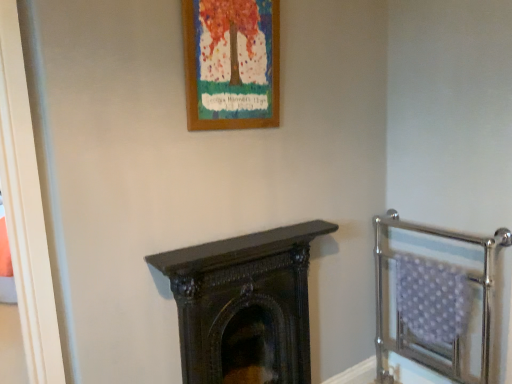
Question: Considering the positions of wooden frame at upper center and dark wood fireplace at center in the image, is wooden frame at upper center wider or thinner than dark wood fireplace at center?

Choices:
 (A) thin
 (B) wide

Answer: (A)

Question: In the image, is wooden frame at upper center positioned in front of or behind dark wood fireplace at center?

Choices:
 (A) front
 (B) behind

Answer: (A)

Question: Considering the real-world distances, which object is farthest from the dark wood fireplace at center?

Choices:
 (A) wooden frame at upper center
 (B) polished chrome balustrade at right

Answer: (A)

Question: Which is nearer to the dark wood fireplace at center?

Choices:
 (A) wooden frame at upper center
 (B) polished chrome balustrade at right

Answer: (B)